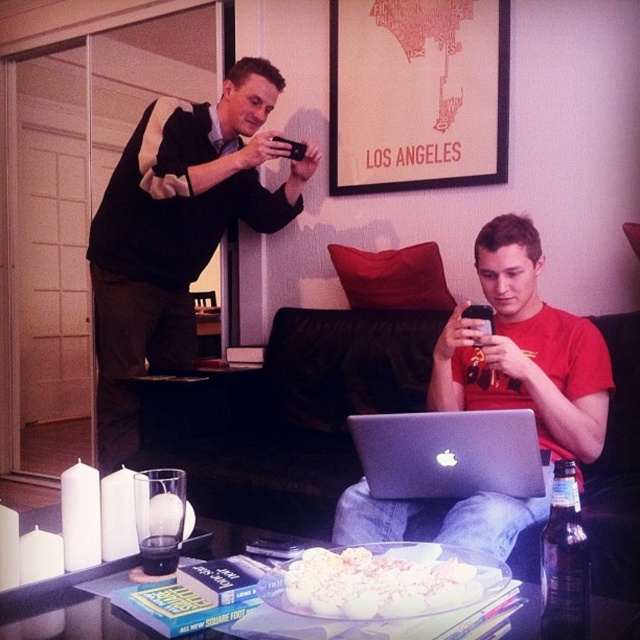
You are a guest at a party and want to sit on the black leather couch at center. However, there is a white creamy dessert at center on the coffee table. Can you sit there without moving the dessert?

The black leather couch at center has a larger size compared to white creamy dessert at center, so yes, you can sit there without moving the dessert because the couch is bigger and provides enough space.

You are sitting in the living room and want to reach the silver metallic laptop at center without moving the matte red shirt at center. Is this possible?

The matte red shirt at center is in front of the silver metallic laptop at center, so you cannot reach the silver metallic laptop at center without moving the matte red shirt at center.